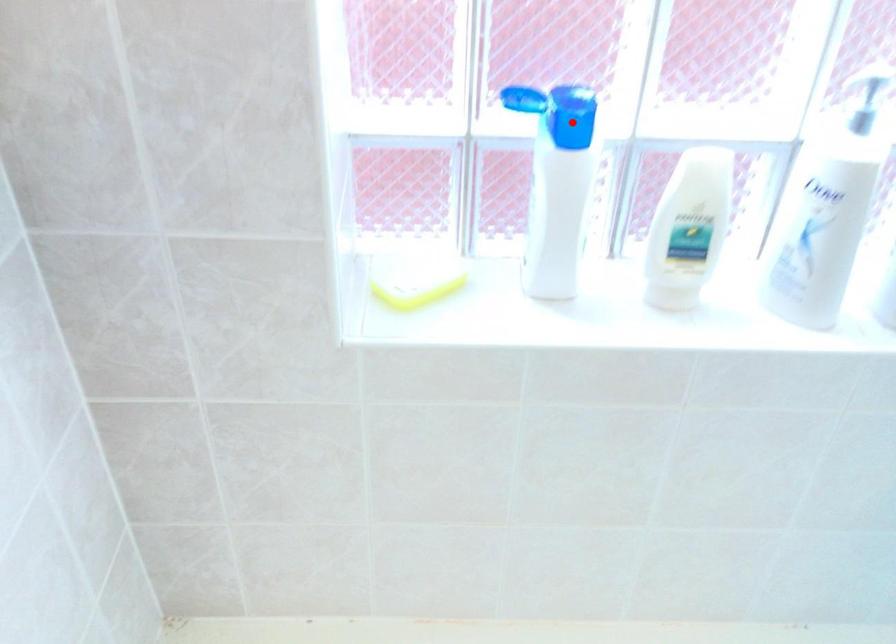
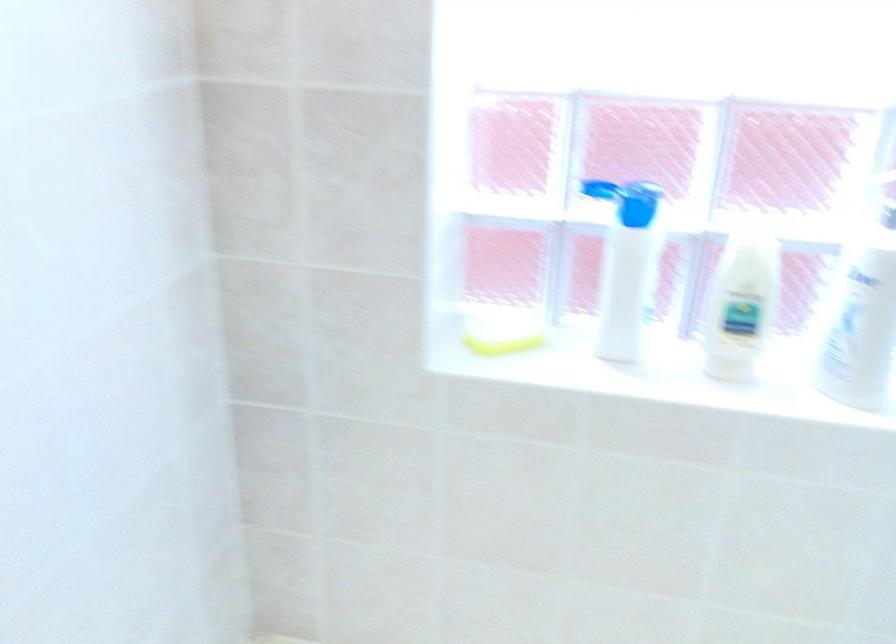
Question: I am providing you with two images of the same scene from different viewpoints. Given a red point in image1, look at the same physical point in image2. Is it:

Choices:
 (A) Closer to the viewpoint
 (B) Farther from the viewpoint

Answer: (B)